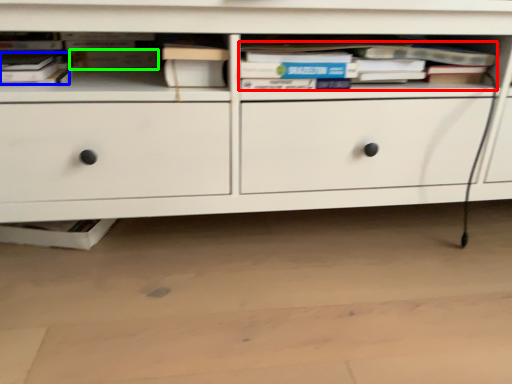
Question: Considering the real-world distances, which object is farthest from book (highlighted by a red box)? book (highlighted by a blue box) or paperback book (highlighted by a green box)?

Choices:
 (A) book
 (B) paperback book

Answer: (A)